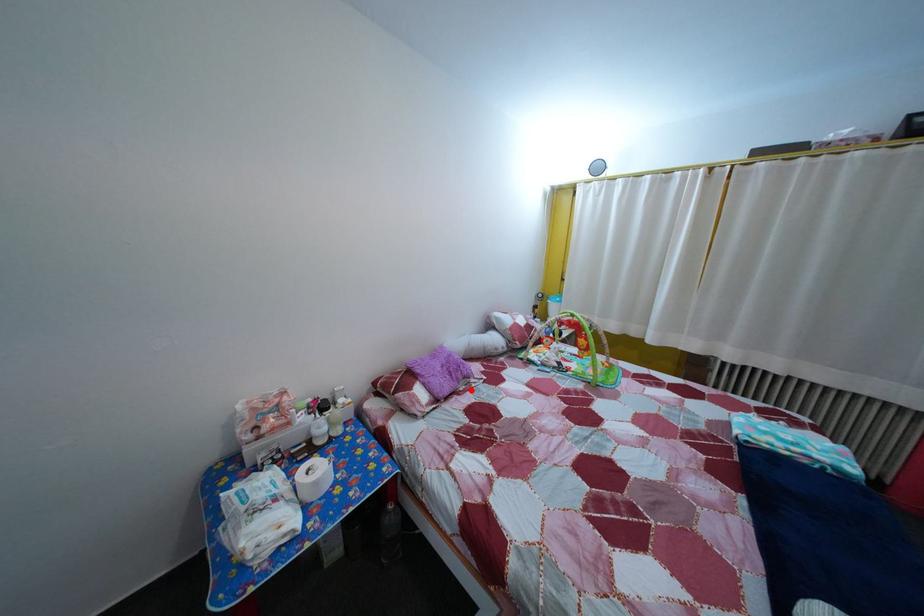
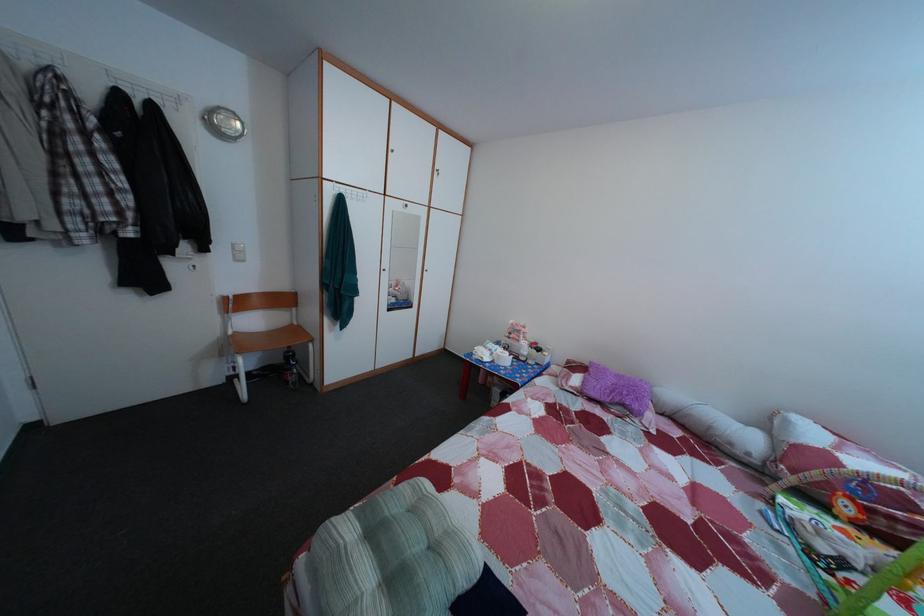
Question: I am providing you with two images of the same scene from different viewpoints. A red point is shown in image1. For the corresponding object point in image2, is it positioned nearer or farther from the camera?

Choices:
 (A) Nearer
 (B) Farther

Answer: (A)